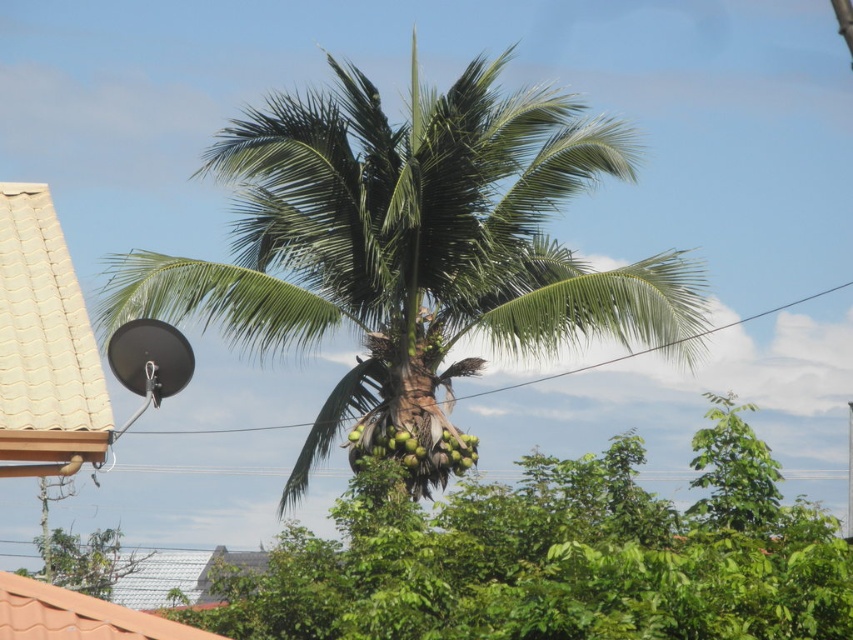
Question: Estimate the real-world distances between objects in this image. Which object is farther from the green leafy palm tree at center?

Choices:
 (A) green leafy coconut tree at center
 (B) green coconut at center

Answer: (A)

Question: Does green leafy palm tree at center appear on the right side of green coconut at center?

Choices:
 (A) yes
 (B) no

Answer: (A)

Question: Can you confirm if green leafy palm tree at center is wider than green coconut at center?

Choices:
 (A) no
 (B) yes

Answer: (B)

Question: Can you confirm if green leafy coconut tree at center is thinner than green coconut at center?

Choices:
 (A) no
 (B) yes

Answer: (A)

Question: Estimate the real-world distances between objects in this image. Which object is farther from the green leafy palm tree at center?

Choices:
 (A) green leafy coconut tree at center
 (B) green coconut at center

Answer: (A)

Question: Which is nearer to the green leafy palm tree at center?

Choices:
 (A) green leafy coconut tree at center
 (B) green coconut at center

Answer: (B)